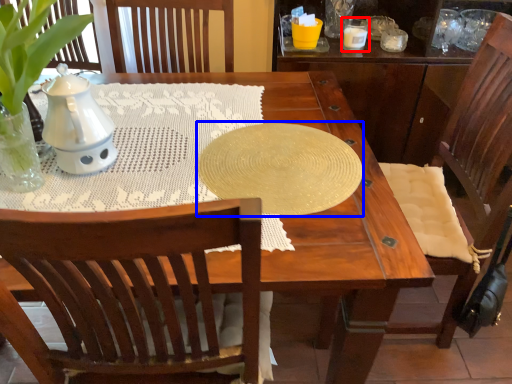
Question: Which object appears farthest to the camera in this image, candle holder (highlighted by a red box) or oval (highlighted by a blue box)?

Choices:
 (A) candle holder
 (B) oval

Answer: (A)